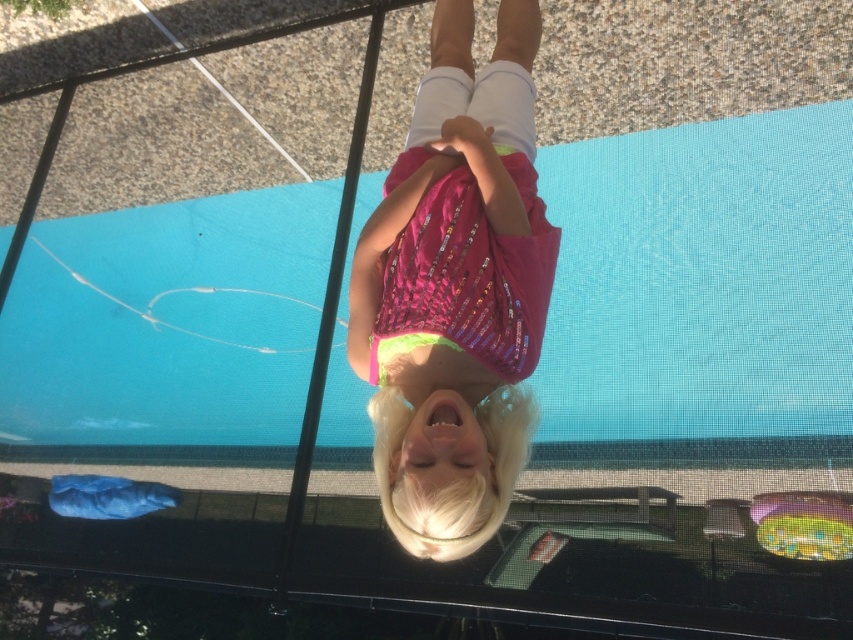
Question: Which object appears farthest from the camera in this image?

Choices:
 (A) blue rubber mat at center
 (B) pink sequined shirt at center

Answer: (A)

Question: Is blue rubber mat at center to the right of pink sequined shirt at center from the viewer's perspective?

Choices:
 (A) no
 (B) yes

Answer: (B)

Question: Is the position of blue rubber mat at center more distant than that of pink sequined shirt at center?

Choices:
 (A) no
 (B) yes

Answer: (B)

Question: Is blue rubber mat at center above pink sequined shirt at center?

Choices:
 (A) yes
 (B) no

Answer: (B)